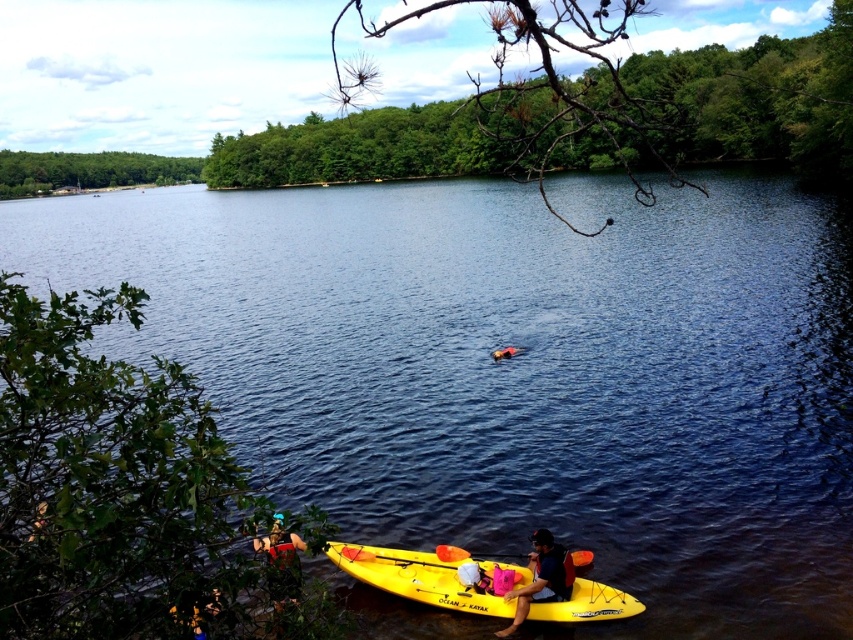
You are planning to take a photo of the blue water at center and the yellow plastic kayak at lower center. Which object should you focus on first if you want to capture both in the frame without moving the camera?

The blue water at center should be focused on first because it is wider than the yellow plastic kayak at lower center, allowing the kayak to fit within the same frame when centered on the water.

You are a photographer trying to capture the yellow matte kayak at lower center and the yellow plastic paddle at lower center in the same frame. Which object should you focus on first to ensure both are in focus?

The yellow matte kayak at lower center is in front of the yellow plastic paddle at lower center, so you should focus on the yellow matte kayak at lower center first to ensure both are in focus.

You are a drone operator tasked with capturing aerial footage of the yellow matte kayak at lower center. Based on its position in the scene, which direction should you adjust the drone to ensure the kayak is centered in the frame?

The yellow matte kayak at lower center is located at point coordinates, so you should adjust the drone slightly upwards and to the left to center it in the frame.